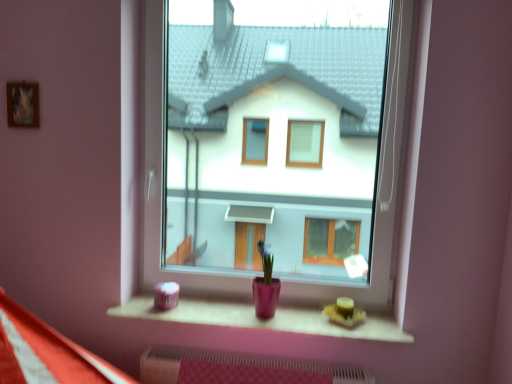
Find the location of a particular element. free area below transparent glass window at center (from a real-world perspective) is located at coordinates (253, 305).